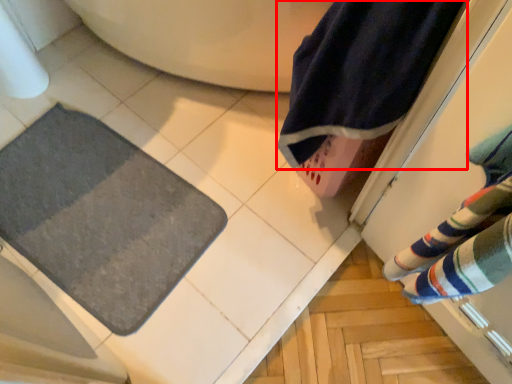
Question: From the image's perspective, what is the correct spatial positioning of beach towel (annotated by the red box) in reference to bath mat?

Choices:
 (A) above
 (B) below

Answer: (A)